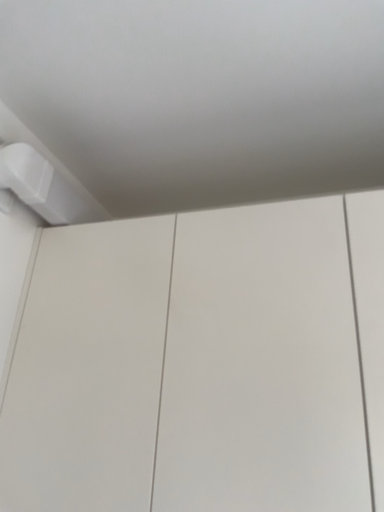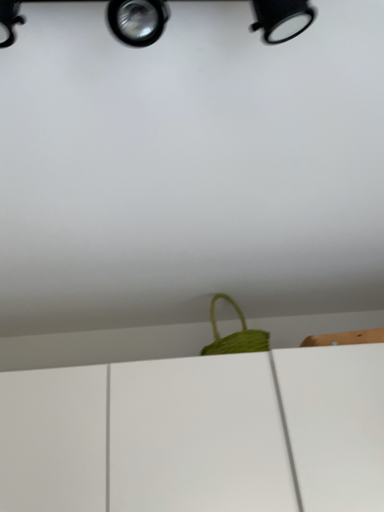
Question: How did the camera likely rotate when shooting the video?

Choices:
 (A) rotated left
 (B) rotated right

Answer: (B)